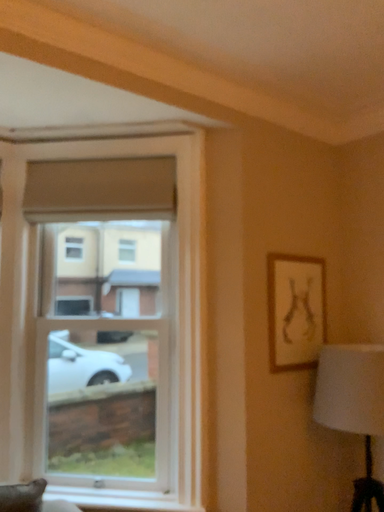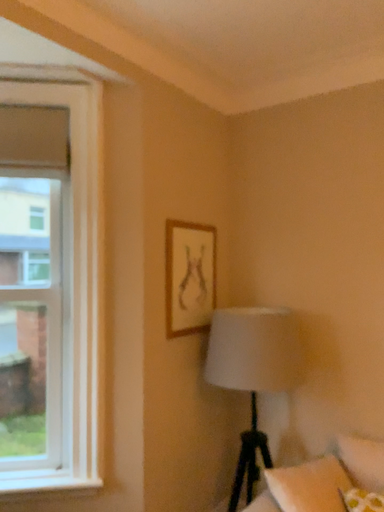
Question: How did the camera likely rotate when shooting the video?

Choices:
 (A) rotated left
 (B) rotated right

Answer: (B)